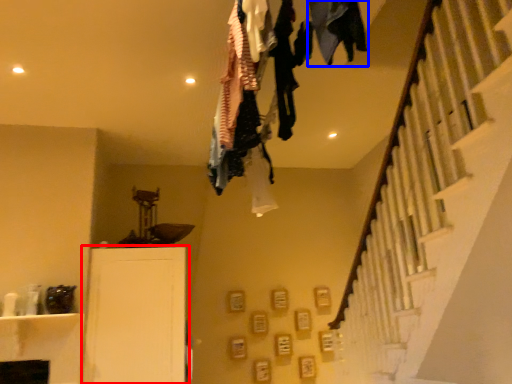
Question: Among these objects, which one is nearest to the camera, furniture (highlighted by a red box) or clothing (highlighted by a blue box)?

Choices:
 (A) furniture
 (B) clothing

Answer: (B)